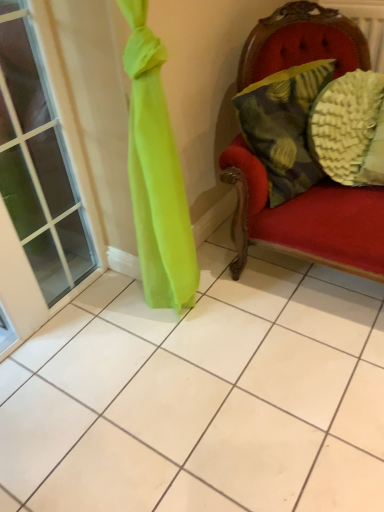
Question: Does textured yellow-green pillow at right, positioned as the 1th pillow in left-to-right order, lie behind clear glass window at left?

Choices:
 (A) no
 (B) yes

Answer: (B)

Question: From a real-world perspective, is textured yellow-green pillow at right, which ranks as the 2th pillow in right-to-left order, under clear glass window at left?

Choices:
 (A) no
 (B) yes

Answer: (A)

Question: Can you confirm if textured yellow-green pillow at right, which ranks as the 2th pillow in right-to-left order, is thinner than clear glass window at left?

Choices:
 (A) no
 (B) yes

Answer: (A)

Question: From a real-world perspective, is textured yellow-green pillow at right, positioned as the 1th pillow in left-to-right order, on top of clear glass window at left?

Choices:
 (A) no
 (B) yes

Answer: (B)

Question: Is textured yellow-green pillow at right, positioned as the 1th pillow in left-to-right order, closer to camera compared to clear glass window at left?

Choices:
 (A) no
 (B) yes

Answer: (A)

Question: Would you say textured yellow-green pillow at right, positioned as the 1th pillow in left-to-right order, is inside or outside textured yellow pillow at right, the 1th pillow viewed from the right?

Choices:
 (A) outside
 (B) inside

Answer: (A)

Question: Considering the relative positions of textured yellow-green pillow at right, positioned as the 1th pillow in left-to-right order, and textured yellow pillow at right, the 1th pillow viewed from the right, in the image provided, is textured yellow-green pillow at right, positioned as the 1th pillow in left-to-right order, to the left or to the right of textured yellow pillow at right, the 1th pillow viewed from the right,?

Choices:
 (A) left
 (B) right

Answer: (A)

Question: Considering the positions of point (256, 133) and point (349, 121), is point (256, 133) closer or farther from the camera than point (349, 121)?

Choices:
 (A) closer
 (B) farther

Answer: (A)

Question: From the image's perspective, is textured yellow-green pillow at right, positioned as the 1th pillow in left-to-right order, located above or below textured yellow pillow at right, which ranks as the second pillow in left-to-right order?

Choices:
 (A) above
 (B) below

Answer: (A)

Question: From the image's perspective, relative to clear glass window at left, is textured yellow-green pillow at right, which ranks as the 2th pillow in right-to-left order, above or below?

Choices:
 (A) below
 (B) above

Answer: (B)

Question: Looking at their shapes, would you say textured yellow-green pillow at right, which ranks as the 2th pillow in right-to-left order, is wider or thinner than clear glass window at left?

Choices:
 (A) wide
 (B) thin

Answer: (A)

Question: Based on their positions, is textured yellow-green pillow at right, positioned as the 1th pillow in left-to-right order, located to the left or right of clear glass window at left?

Choices:
 (A) left
 (B) right

Answer: (B)

Question: Is textured yellow-green pillow at right, positioned as the 1th pillow in left-to-right order, spatially inside clear glass window at left, or outside of it?

Choices:
 (A) inside
 (B) outside

Answer: (B)

Question: In terms of size, does clear glass window at left appear bigger or smaller than textured yellow-green pillow at right, positioned as the 1th pillow in left-to-right order?

Choices:
 (A) big
 (B) small

Answer: (A)

Question: Which is correct: clear glass window at left is inside textured yellow-green pillow at right, positioned as the 1th pillow in left-to-right order, or outside of it?

Choices:
 (A) inside
 (B) outside

Answer: (B)